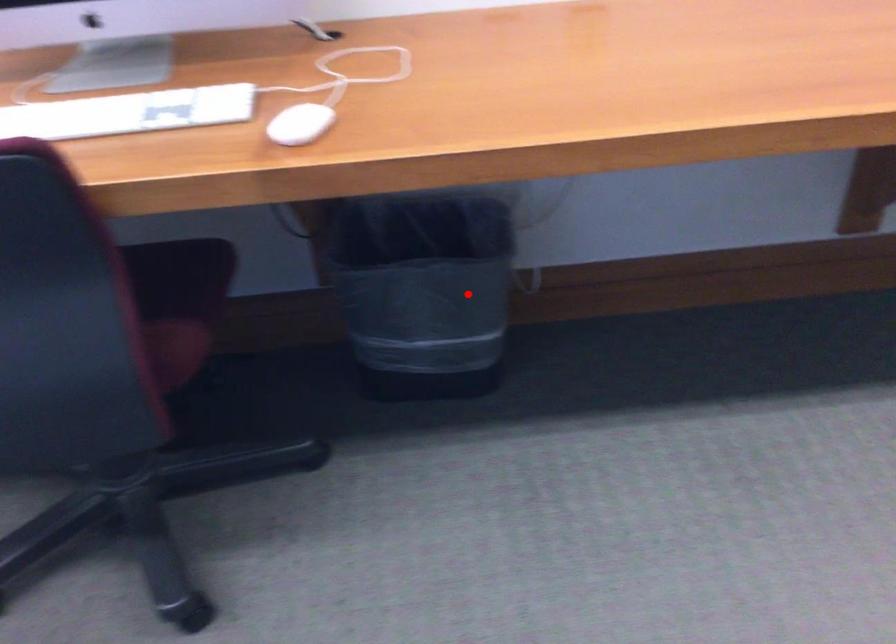
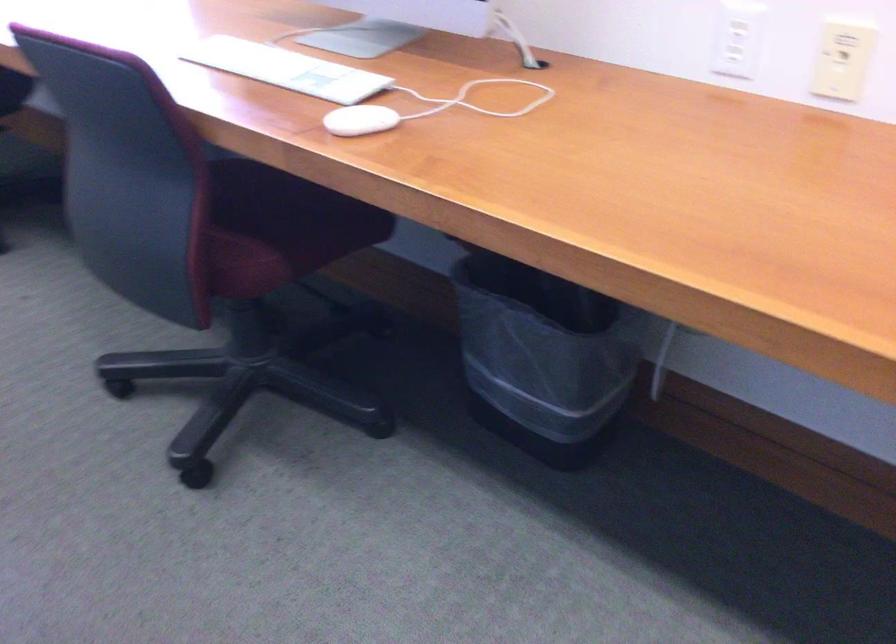
Find the pixel in the second image that matches the highlighted location in the first image.

(543, 357)